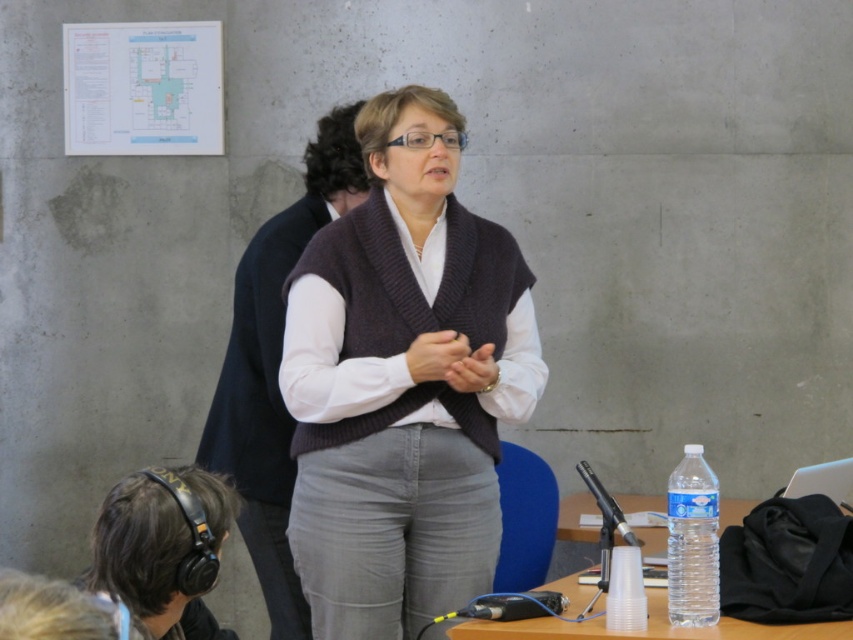
Question: Based on their relative distances, which object is farther from the knitted dark brown vest at center?

Choices:
 (A) clear plastic bottle at right
 (B) clear plastic cup at lower center

Answer: (B)

Question: Which object is closer to the camera taking this photo?

Choices:
 (A) clear plastic bottle at right
 (B) knitted dark brown vest at center

Answer: (A)

Question: Which object is closer to the camera taking this photo?

Choices:
 (A) knitted dark brown vest at center
 (B) clear plastic cup at lower center

Answer: (A)

Question: Is knitted dark brown vest at center to the left of clear plastic cup at lower center from the viewer's perspective?

Choices:
 (A) yes
 (B) no

Answer: (A)

Question: Is knitted dark brown vest at center behind clear plastic bottle at right?

Choices:
 (A) yes
 (B) no

Answer: (A)

Question: Can you confirm if clear plastic cup at lower center is positioned below clear plastic bottle at right?

Choices:
 (A) no
 (B) yes

Answer: (B)